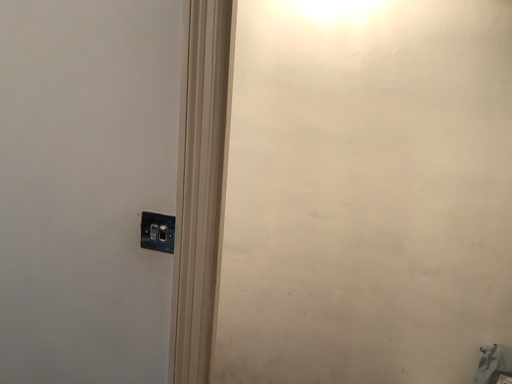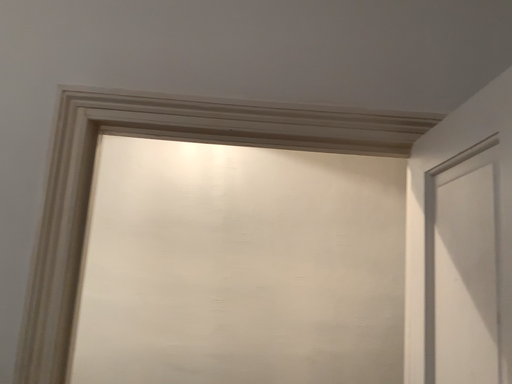
Question: Which way did the camera rotate in the video?

Choices:
 (A) rotated downward
 (B) rotated upward

Answer: (B)